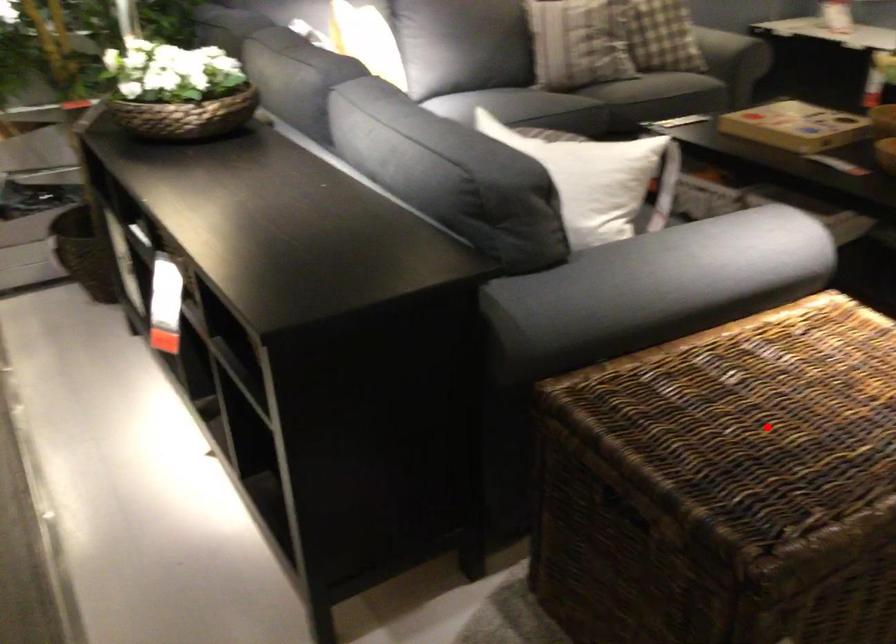
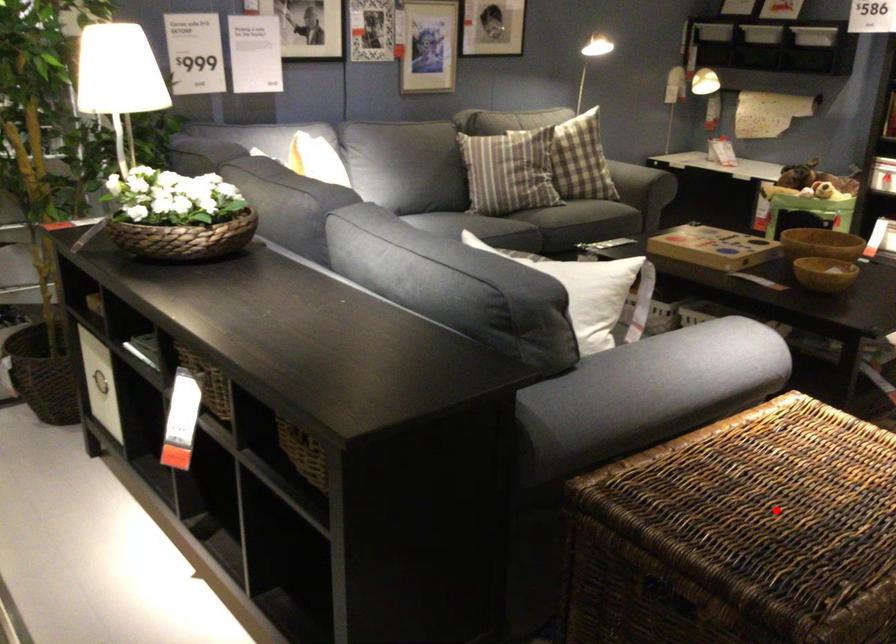
I am providing you with two images of the same scene from different viewpoints. A red point is marked on the first image and another point is marked on the second image. Do the highlighted points in image1 and image2 indicate the same real-world spot?

Yes